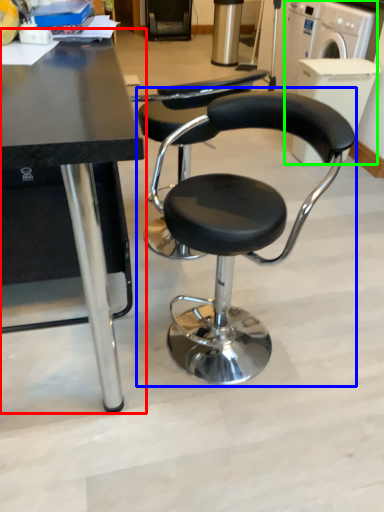
Question: Which is farther away from table (highlighted by a red box)? chair (highlighted by a blue box) or washing machine (highlighted by a green box)?

Choices:
 (A) chair
 (B) washing machine

Answer: (B)